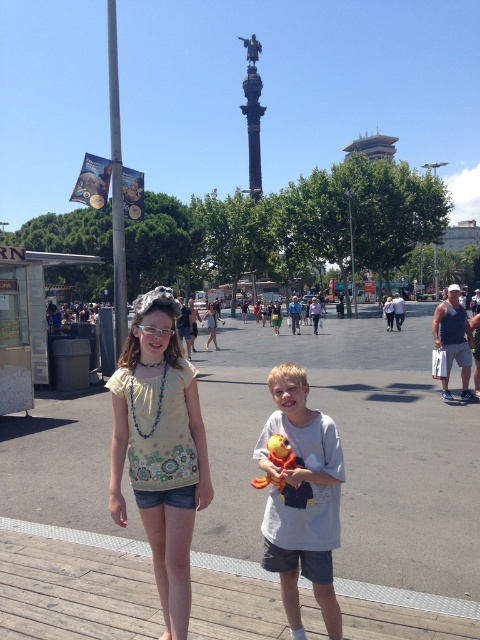
You are standing in the plaza and want to take a photo of the light yellow cotton shirt at center and the wooden at center. Which object should you position to the right side of your camera frame to include both?

You should position the wooden at center to the right side of your camera frame since it is already to the right of the light yellow cotton shirt at center.

You are a photographer trying to capture both the light yellow cotton shirt at center and the light gray cotton shirt at center in a single frame. Based on their positions, which one should you adjust your camera to focus on first to ensure both are in the shot?

The light yellow cotton shirt at center is to the left of light gray cotton shirt at center, so you should focus on the light gray cotton shirt at center first to ensure the camera captures the entire area from right to left, including both shirts.

You are a photographer standing in the plaza and want to take a photo of the wooden at center and the light yellow cotton shirt at center. Which object should you focus on first to ensure both are in focus?

You should focus on the wooden at center first because it is closer to you than the light yellow cotton shirt at center, ensuring both will be in focus when using a proper depth of field.